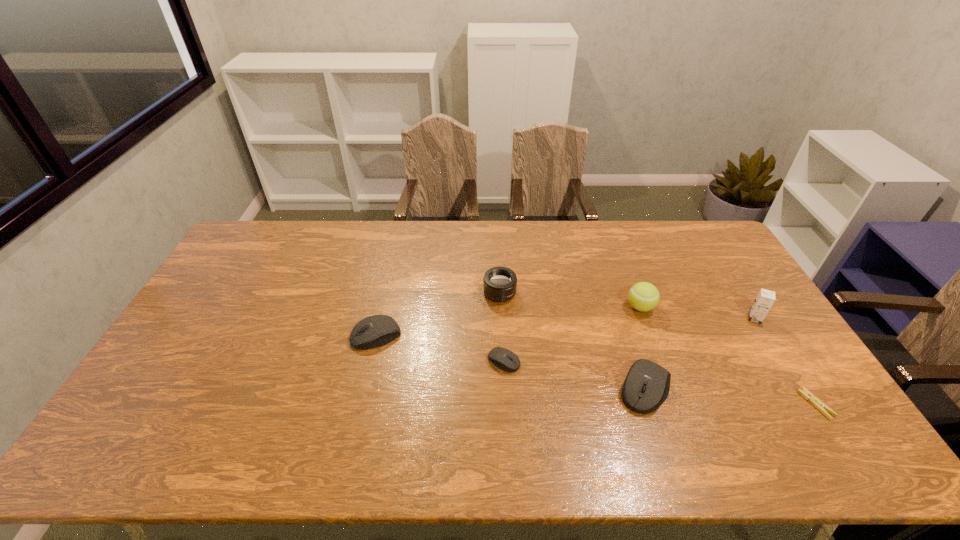
With all computer equipments evenly spaced, where should an extra computer equipment be placed on the right to continue the pattern? Please point out a vacant space. Please provide its 2D coordinates. Your answer should be formatted as a tuple, i.e. [(x, y)], where the tuple contains the x and y coordinates of a point satisfying the conditions above.

[(805, 421)]